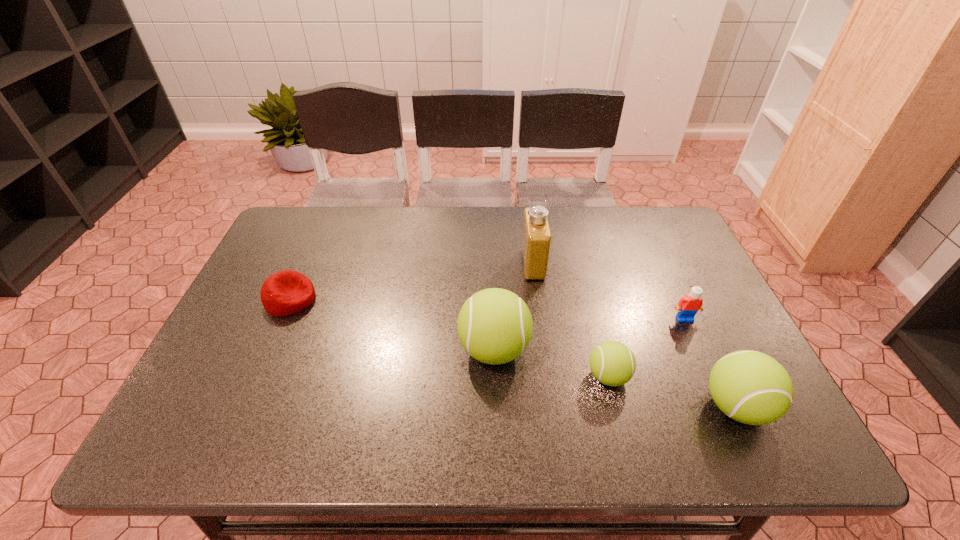
At what (x,y) coordinates should I click in order to perform the action: click on the leftmost tennis ball. Please return your answer as a coordinate pair (x, y). The width and height of the screenshot is (960, 540). Looking at the image, I should click on (494, 326).

Locate an element on the screen. This screenshot has width=960, height=540. the third object from right to left is located at coordinates (612, 363).

Where is `the second tennis ball from right to left`? the second tennis ball from right to left is located at coordinates (612, 363).

In order to click on the third tallest object in this screenshot , I will do `click(750, 387)`.

Image resolution: width=960 pixels, height=540 pixels. Find the location of `the rightmost tennis ball`. the rightmost tennis ball is located at coordinates (750, 387).

Locate an element on the screen. Lego is located at coordinates (688, 306).

Where is `the farthest object`? the farthest object is located at coordinates (536, 241).

Where is `perfume`? The height and width of the screenshot is (540, 960). perfume is located at coordinates (536, 241).

Where is `beanbag`? beanbag is located at coordinates (287, 292).

Locate an element on the screen. The width and height of the screenshot is (960, 540). the shortest object is located at coordinates (287, 292).